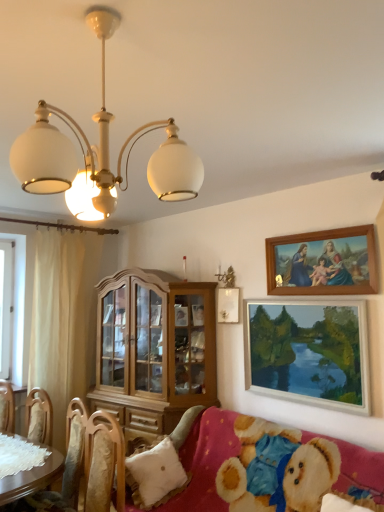
Find the location of a particular element. The height and width of the screenshot is (512, 384). empty space that is ontop of wooden picture frame at upper right, the 2th picture frame ordered from the bottom (from a real-world perspective) is located at coordinates (320, 225).